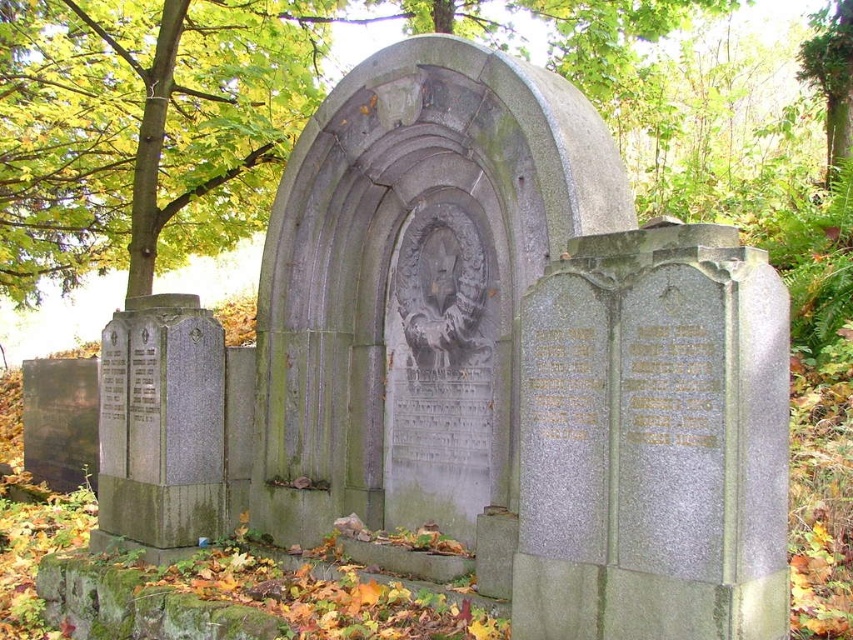
You are standing in the cemetery and want to take a photo of the gray stone plaque at left and the green leafy tree at upper center. Which object should you focus on first to ensure both are in the frame?

You should focus on the green leafy tree at upper center first because it is closer to you than the gray stone plaque at left, ensuring both are in the frame.

You are a groundskeeper planning to water the green leafy tree at upper left and the gray stone plaque at left. Your watering hose is 15 feet long. Can you reach both objects with the hose without moving the hose nozzle?

The distance between the green leafy tree at upper left and the gray stone plaque at left is 17.25 feet, which is longer than the 15 feet hose. Therefore, you cannot water both without moving the hose nozzle.